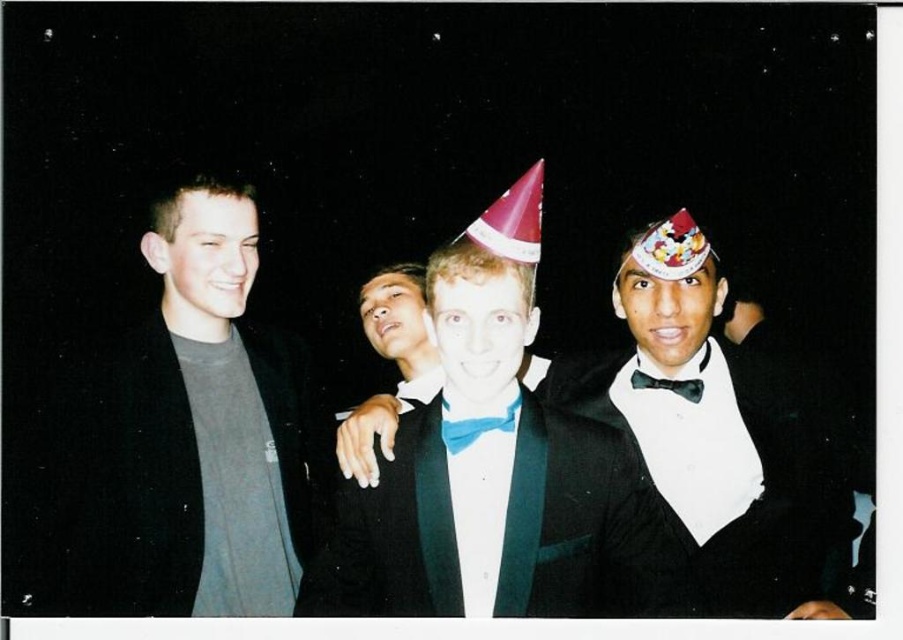
Question: Which point is farther to the camera?

Choices:
 (A) black satin bow tie at center
 (B) shiny black tuxedo at center

Answer: (A)

Question: Which point appears closest to the camera in this image?

Choices:
 (A) (78, 506)
 (B) (442, 435)
 (C) (697, 380)

Answer: (B)

Question: Which object appears closest to the camera in this image?

Choices:
 (A) blue satin bow tie at center
 (B) shiny black tuxedo at center
 (C) gray cotton t-shirt at left

Answer: (A)

Question: Does gray cotton t-shirt at left appear over black satin bow tie at center?

Choices:
 (A) no
 (B) yes

Answer: (A)

Question: Does shiny black tuxedo at center have a larger size compared to blue satin bow tie at center?

Choices:
 (A) no
 (B) yes

Answer: (B)

Question: Is gray cotton t-shirt at left thinner than black satin bow tie at center?

Choices:
 (A) no
 (B) yes

Answer: (A)